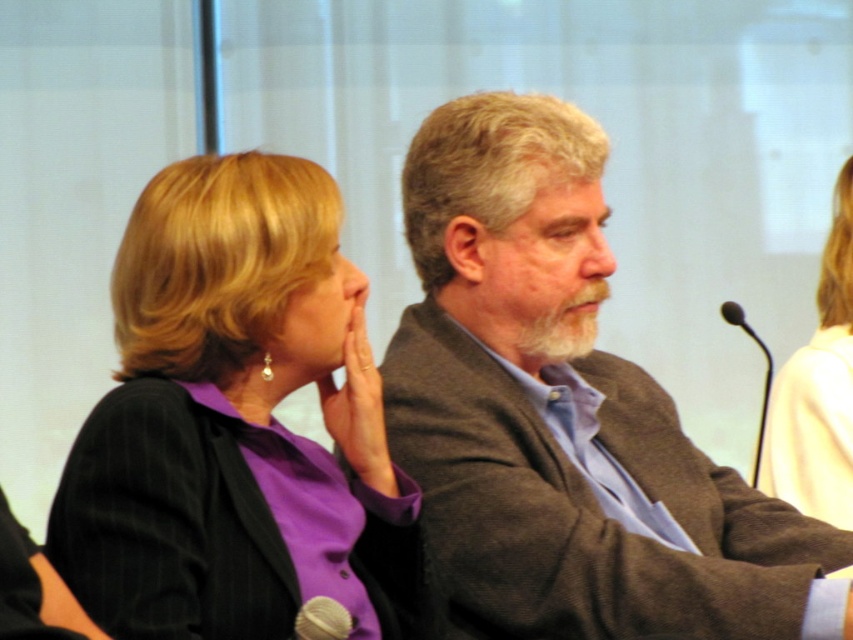
Question: Does silver metallic microphone at lower left lie in front of black metallic microphone at right?

Choices:
 (A) no
 (B) yes

Answer: (B)

Question: Based on their relative distances, which object is farther from the brown woolen jacket at center?

Choices:
 (A) silver metallic microphone at lower left
 (B) black metallic microphone at right
 (C) purple matte blazer at center

Answer: (B)

Question: Among these points, which one is farthest from the camera?

Choices:
 (A) (647, 486)
 (B) (312, 188)
 (C) (325, 600)

Answer: (A)

Question: Which object is farther from the camera taking this photo?

Choices:
 (A) silver metallic microphone at lower left
 (B) light beige sweater at upper right

Answer: (B)

Question: Can you confirm if brown woolen jacket at center is positioned to the left of black metallic microphone at right?

Choices:
 (A) no
 (B) yes

Answer: (B)

Question: Is brown woolen jacket at center bigger than black metallic microphone at right?

Choices:
 (A) no
 (B) yes

Answer: (B)